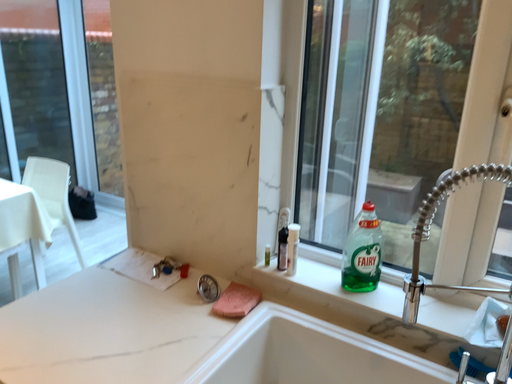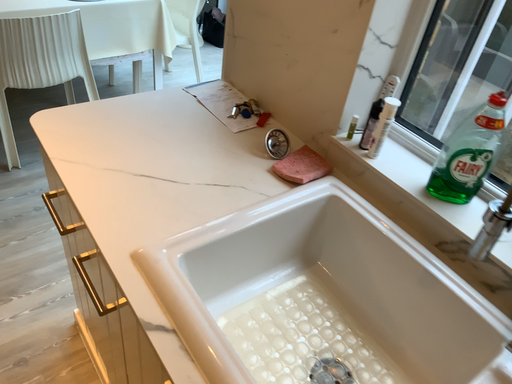
Question: Which way did the camera rotate in the video?

Choices:
 (A) rotated left
 (B) rotated right

Answer: (A)